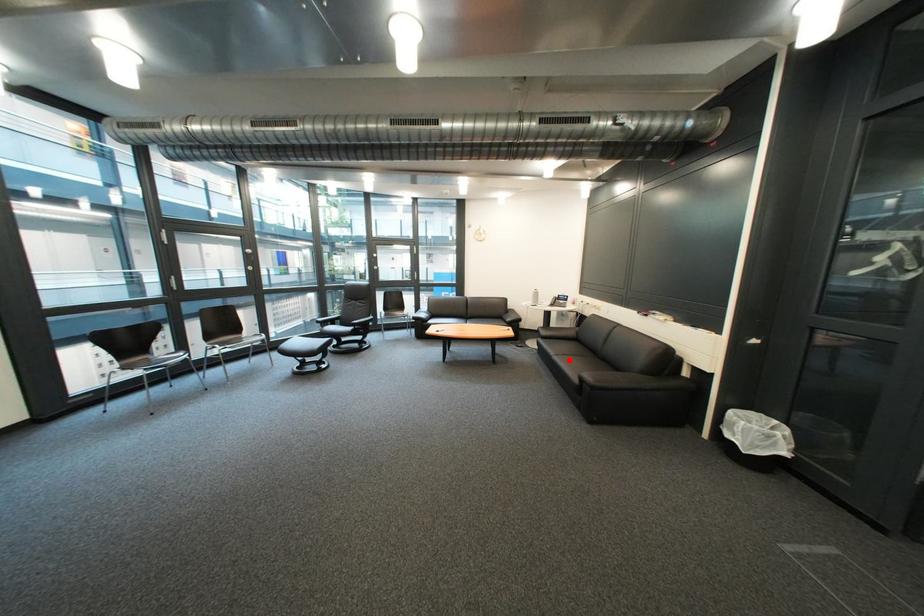
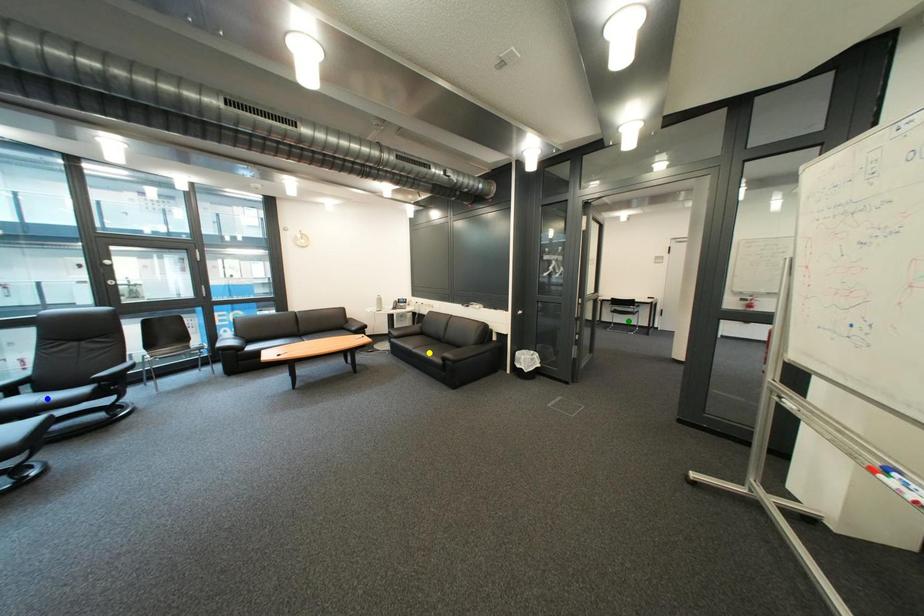
Question: I am providing you with two images of the same scene from different viewpoints. A red point is marked on the first image. You are given multiple points on the second image. In image 2, which mark is for the same physical point as the one in image 1?

Choices:
 (A) blue point
 (B) yellow point
 (C) green point

Answer: (B)